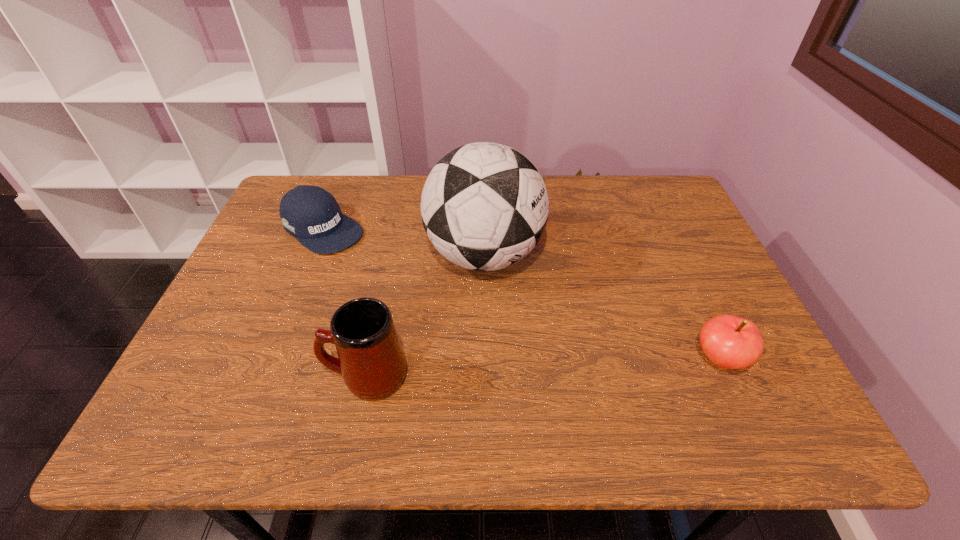
Identify which object is the third nearest to the second tallest object. Please provide its 2D coordinates. Your answer should be formatted as a tuple, i.e. [(x, y)], where the tuple contains the x and y coordinates of a point satisfying the conditions above.

[(731, 342)]

Where is `free location that satisfies the following two spatial constraints: 1. on the front side of the apple; 2. on the right side of the soccer ball`? The image size is (960, 540). free location that satisfies the following two spatial constraints: 1. on the front side of the apple; 2. on the right side of the soccer ball is located at coordinates (485, 359).

Where is `free location that satisfies the following two spatial constraints: 1. on the front side of the apple; 2. on the left side of the soccer ball`? This screenshot has height=540, width=960. free location that satisfies the following two spatial constraints: 1. on the front side of the apple; 2. on the left side of the soccer ball is located at coordinates (485, 359).